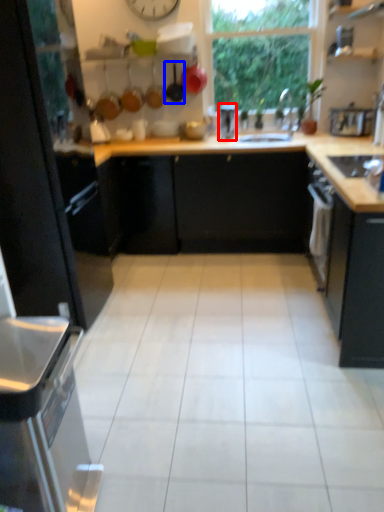
Question: Which object is closer to the camera taking this photo, appliance (highlighted by a red box) or frying pan (highlighted by a blue box)?

Choices:
 (A) appliance
 (B) frying pan

Answer: (A)